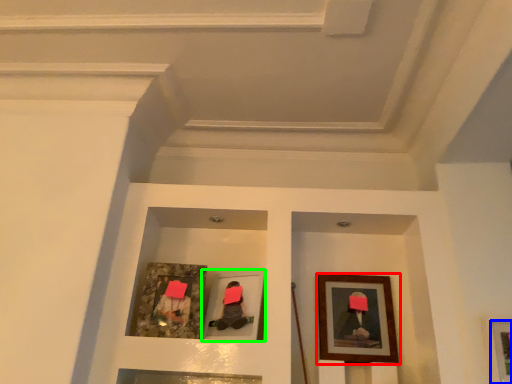
Question: Which is farther away from picture frame (highlighted by a red box)? picture frame (highlighted by a blue box) or picture frame (highlighted by a green box)?

Choices:
 (A) picture frame
 (B) picture frame

Answer: (A)